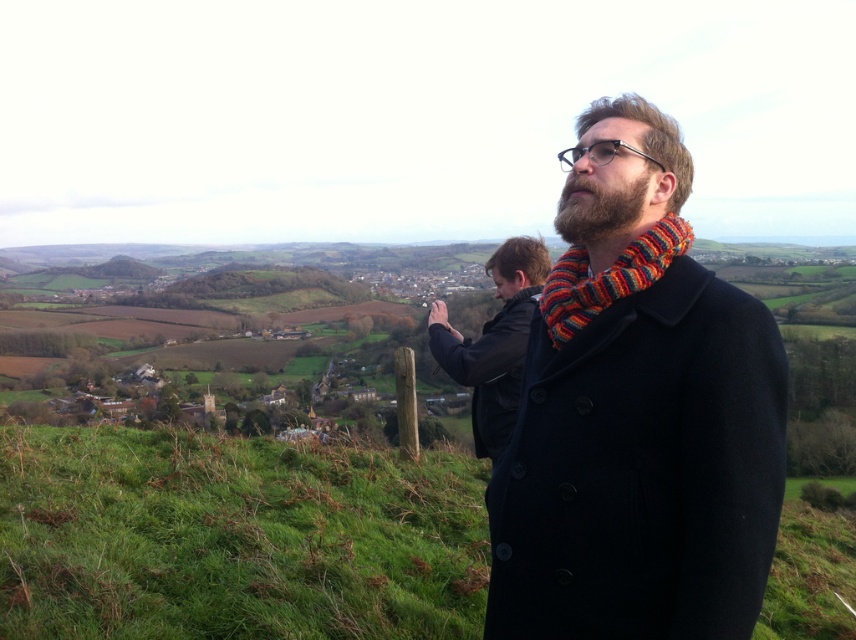
Question: Which point is farther to the camera?

Choices:
 (A) (587, 227)
 (B) (593, 292)
 (C) (642, 104)
 (D) (486, 390)

Answer: (D)

Question: Which object is the farthest from the knitted wool scarf at center?

Choices:
 (A) knitted multicolor scarf at right
 (B) black leather jacket at center

Answer: (B)

Question: Can you confirm if black leather jacket at center is bigger than dark brown beard at center?

Choices:
 (A) no
 (B) yes

Answer: (B)

Question: Does knitted wool scarf at center have a larger size compared to dark brown beard at center?

Choices:
 (A) no
 (B) yes

Answer: (A)

Question: Among these objects, which one is farthest from the camera?

Choices:
 (A) dark brown beard at center
 (B) black leather jacket at center
 (C) knitted wool scarf at center

Answer: (B)

Question: Is knitted wool scarf at center above black leather jacket at center?

Choices:
 (A) no
 (B) yes

Answer: (B)